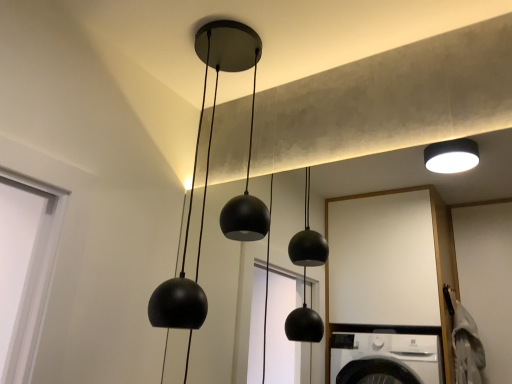
What do you see at coordinates (206, 169) in the screenshot?
I see `matte black pendant light at center` at bounding box center [206, 169].

Where is `matte black pendant light at center`? This screenshot has width=512, height=384. matte black pendant light at center is located at coordinates (206, 169).

Where is `matte black pendant light at center`? matte black pendant light at center is located at coordinates (206, 169).